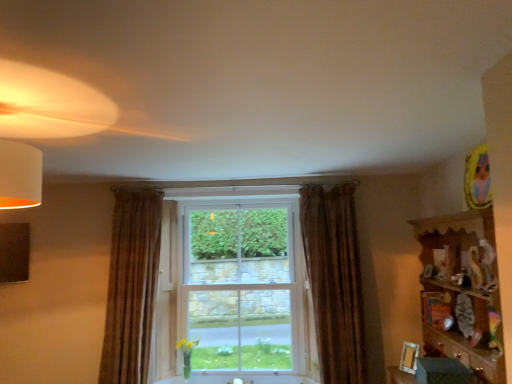
Question: Can you confirm if wooden shelf at right is thinner than clear glass window at center?

Choices:
 (A) no
 (B) yes

Answer: (A)

Question: Is wooden shelf at right at the left side of clear glass window at center?

Choices:
 (A) yes
 (B) no

Answer: (B)

Question: Is wooden shelf at right shorter than clear glass window at center?

Choices:
 (A) yes
 (B) no

Answer: (A)

Question: Is wooden shelf at right oriented away from clear glass window at center?

Choices:
 (A) yes
 (B) no

Answer: (B)

Question: Is wooden shelf at right to the right of clear glass window at center from the viewer's perspective?

Choices:
 (A) yes
 (B) no

Answer: (A)

Question: From a real-world perspective, is wooden shelf at right beneath clear glass window at center?

Choices:
 (A) no
 (B) yes

Answer: (B)

Question: From the image's perspective, does wooden picture frame at lower right appear higher than brown velvet curtain at center, arranged as the 1th curtain when viewed from the right?

Choices:
 (A) yes
 (B) no

Answer: (B)

Question: Is wooden picture frame at lower right completely or partially outside of brown velvet curtain at center, arranged as the 2th curtain when viewed from the left?

Choices:
 (A) yes
 (B) no

Answer: (A)

Question: Can you confirm if wooden picture frame at lower right is taller than brown velvet curtain at center, arranged as the 2th curtain when viewed from the left?

Choices:
 (A) no
 (B) yes

Answer: (A)

Question: From the image's perspective, does wooden picture frame at lower right appear lower than brown velvet curtain at center, arranged as the 2th curtain when viewed from the left?

Choices:
 (A) no
 (B) yes

Answer: (B)

Question: Would you consider wooden picture frame at lower right to be distant from brown velvet curtain at center, arranged as the 1th curtain when viewed from the right?

Choices:
 (A) yes
 (B) no

Answer: (B)

Question: Is wooden picture frame at lower right facing away from brown velvet curtain at center, arranged as the 1th curtain when viewed from the right?

Choices:
 (A) no
 (B) yes

Answer: (A)

Question: Does wooden shelf at right have a smaller size compared to brown textured curtain at left, arranged as the 1th curtain when viewed from the left?

Choices:
 (A) no
 (B) yes

Answer: (A)